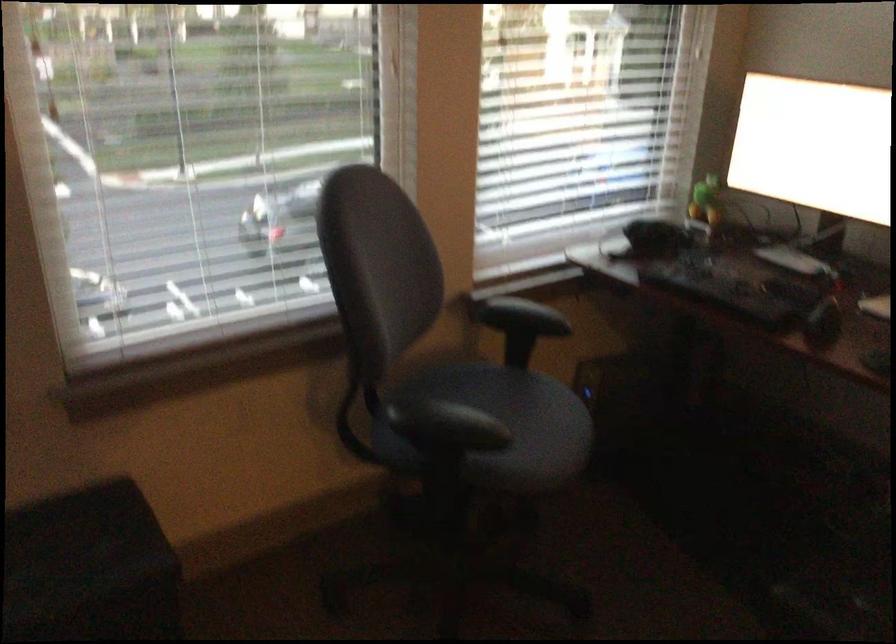
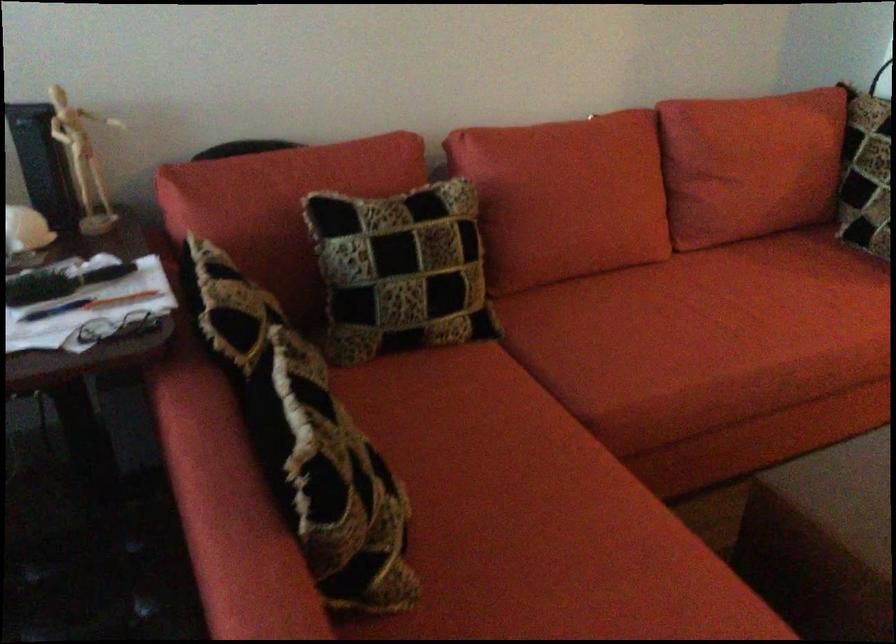
The first image is from the beginning of the video and the second image is from the end. How did the camera likely rotate when shooting the video?

The camera rotated toward right-down.